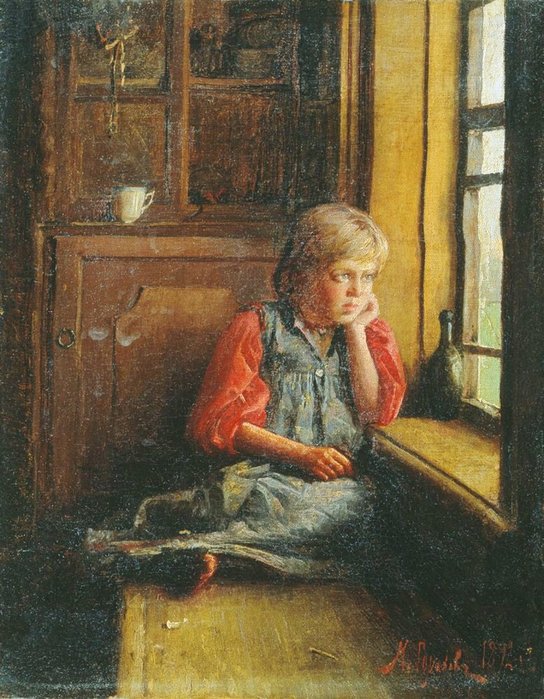
This screenshot has height=699, width=544. Find the location of `glass window on display case`. glass window on display case is located at coordinates (114, 145), (153, 52).